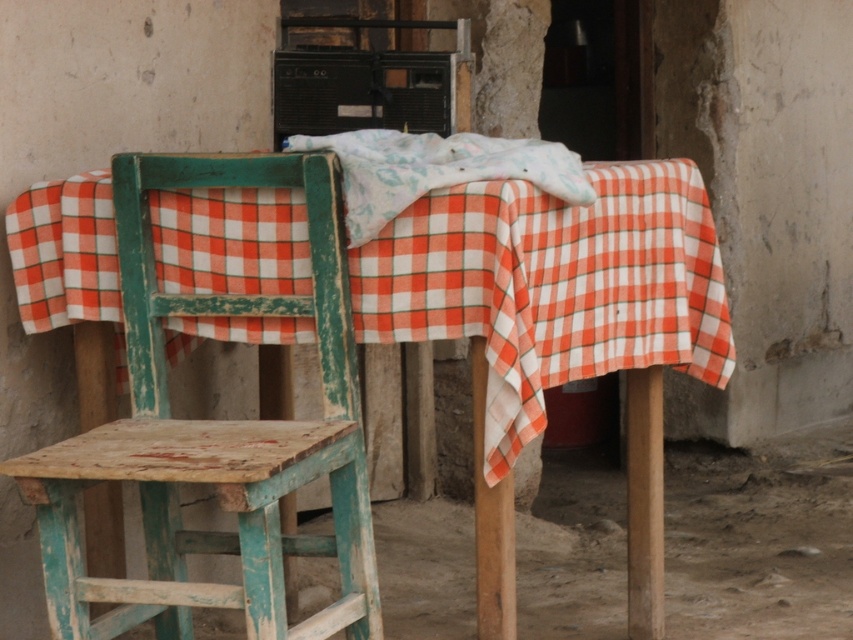
Question: Among these objects, which one is farthest from the camera?

Choices:
 (A) wooden chair at left
 (B) white cotton cloth at center
 (C) checkered fabric tablecloth at center

Answer: (C)

Question: Among these points, which one is nearest to the camera?

Choices:
 (A) (380, 179)
 (B) (212, 442)
 (C) (170, 442)
 (D) (512, 269)

Answer: (A)

Question: Is chipped teal wood stool at left positioned at the back of white cotton cloth at center?

Choices:
 (A) no
 (B) yes

Answer: (A)

Question: Does checkered fabric tablecloth at center appear under wooden chair at left?

Choices:
 (A) no
 (B) yes

Answer: (A)

Question: Which point is farther to the camera?

Choices:
 (A) (318, 632)
 (B) (276, 440)
 (C) (53, 202)
 (D) (482, 147)

Answer: (C)

Question: Is chipped teal wood stool at left wider than white cotton cloth at center?

Choices:
 (A) yes
 (B) no

Answer: (A)